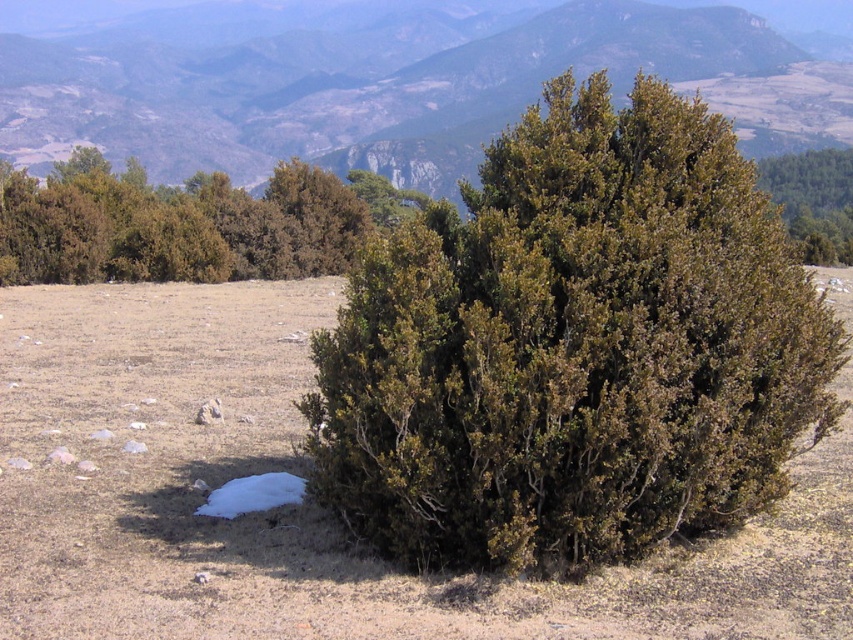
You are planning to place a garden bench between the green leafy bush at center and the green leafy bush at upper center. The bench requires 100 feet of space between the two bushes to be placed safely. Can you place the bench there?

The green leafy bush at center and green leafy bush at upper center are 92.68 feet apart. Since the required space for the bench is 100 feet, the distance is insufficient. Therefore, the bench cannot be placed there.

You are standing in the landscape and want to place a small flag between the green leafy bush at center and the green leafy bush at upper center. Based on their positions, which direction should you place the flag relative to the lower bush to ensure it is between them?

The green leafy bush at center is above the green leafy bush at upper center, so to place the flag between them, you should position it below the green leafy bush at center and above the green leafy bush at upper center.

You are a hiker trying to navigate through the landscape shown. You need to pass between the green leafy bush at upper left and the green leafy bush at upper center. Based on their positions, which direction should you move to go between them?

The green leafy bush at upper left is below the green leafy bush at upper center. To navigate between them, you should move upward towards the green leafy bush at upper center while staying between the two bushes.